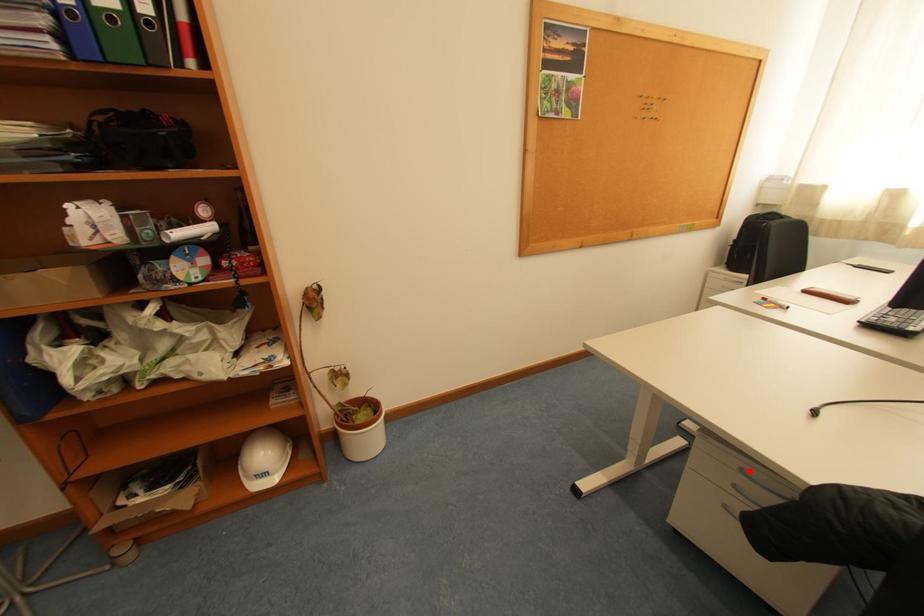
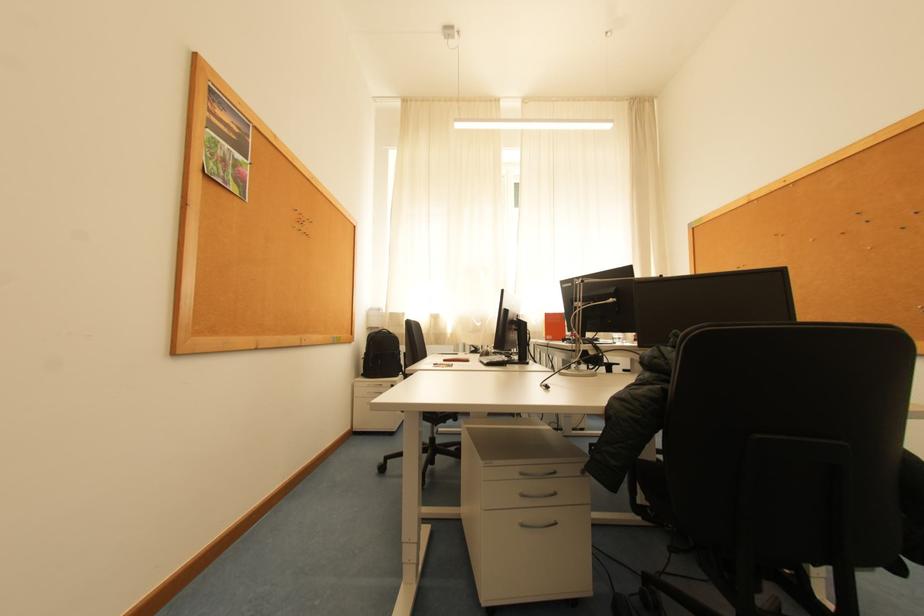
Question: A red point is marked in image1. In image2, is the corresponding 3D point closer to the camera or farther? Reply with the corresponding letter.

Choices:
 (A) The corresponding 3D point is closer.
 (B) The corresponding 3D point is farther.

Answer: (A)